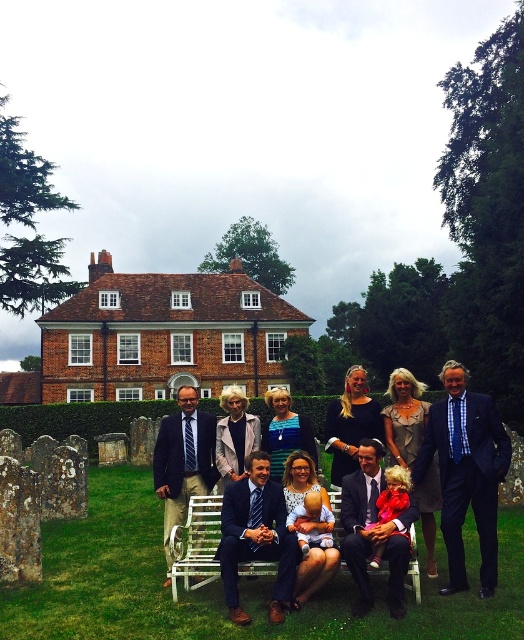
Question: Which object is farther from the camera taking this photo?

Choices:
 (A) white wood bench at center
 (B) dark blue suit at center

Answer: (A)

Question: Is dark blue suit at center bigger than white wood bench at center?

Choices:
 (A) yes
 (B) no

Answer: (A)

Question: Does dark blue suit at center appear on the left side of white wood bench at center?

Choices:
 (A) yes
 (B) no

Answer: (B)

Question: Can you confirm if dark blue suit at center is wider than white wood bench at center?

Choices:
 (A) no
 (B) yes

Answer: (B)